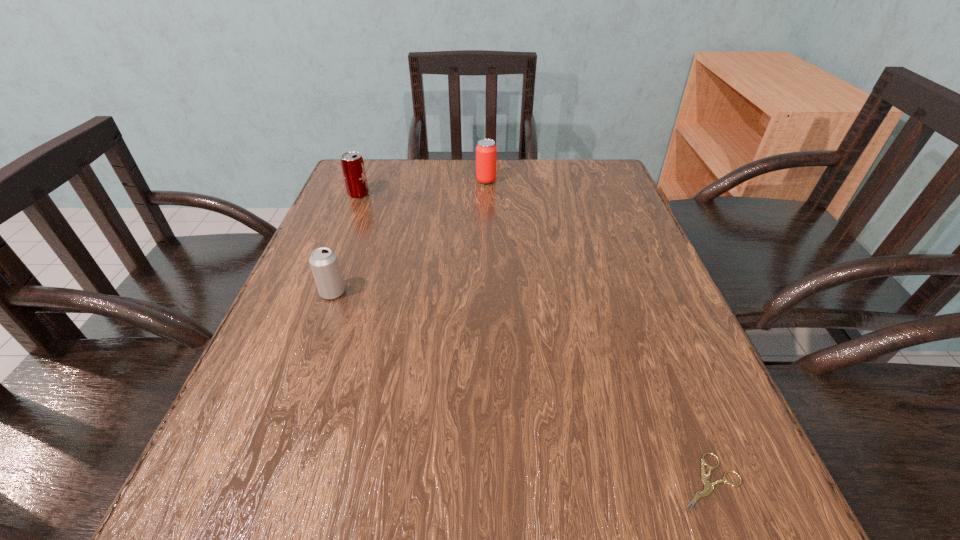
Locate which object is the second closest to the second nearest object. Please provide its 2D coordinates. Your answer should be formatted as a tuple, i.e. [(x, y)], where the tuple contains the x and y coordinates of a point satisfying the conditions above.

[(486, 152)]

You are a GUI agent. You are given a task and a screenshot of the screen. Output one action in this format:
    pyautogui.click(x=<x>, y=<y>)
    Task: Click on the object that can be found as the second closest to the third nearest object
    
    Given the screenshot: What is the action you would take?
    pyautogui.click(x=323, y=261)

Select which beer can appears as the second closest to the nearest beer can. Please provide its 2D coordinates. Your answer should be formatted as a tuple, i.e. [(x, y)], where the tuple contains the x and y coordinates of a point satisfying the conditions above.

[(486, 152)]

Locate which beer can ranks second in proximity to the third farthest object. Please provide its 2D coordinates. Your answer should be formatted as a tuple, i.e. [(x, y)], where the tuple contains the x and y coordinates of a point satisfying the conditions above.

[(486, 152)]

Identify the location of free space that satisfies the following two spatial constraints: 1. on the front side of the farthest object; 2. on the left side of the shears. (492, 483).